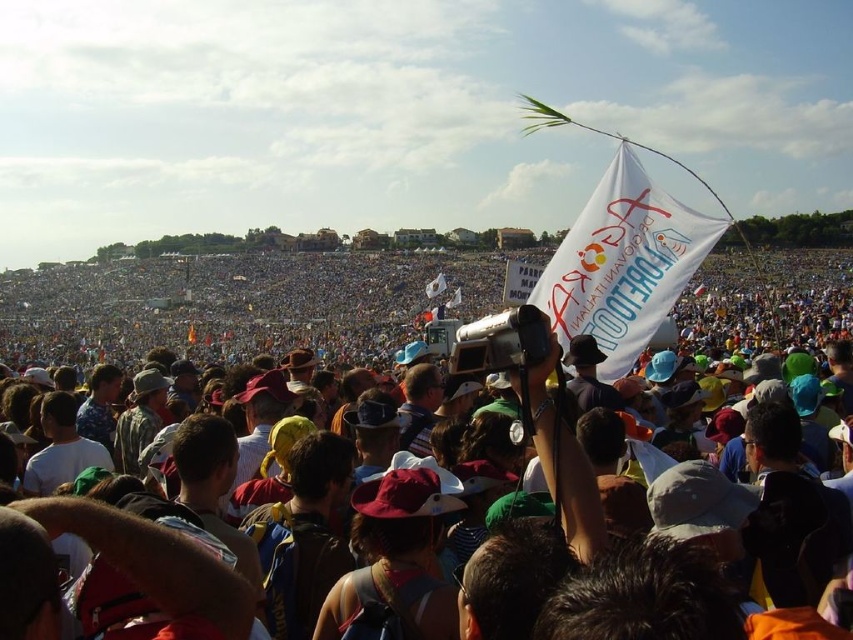
Between point (735, 269) and point (601, 314), which one is positioned behind?

The point (735, 269) is more distant.

Is point (265, 310) farther from viewer compared to point (674, 209)?

Yes, point (265, 310) is farther from viewer.

Does point (80, 358) come closer to viewer compared to point (627, 340)?

No, (80, 358) is behind (627, 340).

This screenshot has height=640, width=853. Find the location of `white paper flag at center`. white paper flag at center is located at coordinates (231, 307).